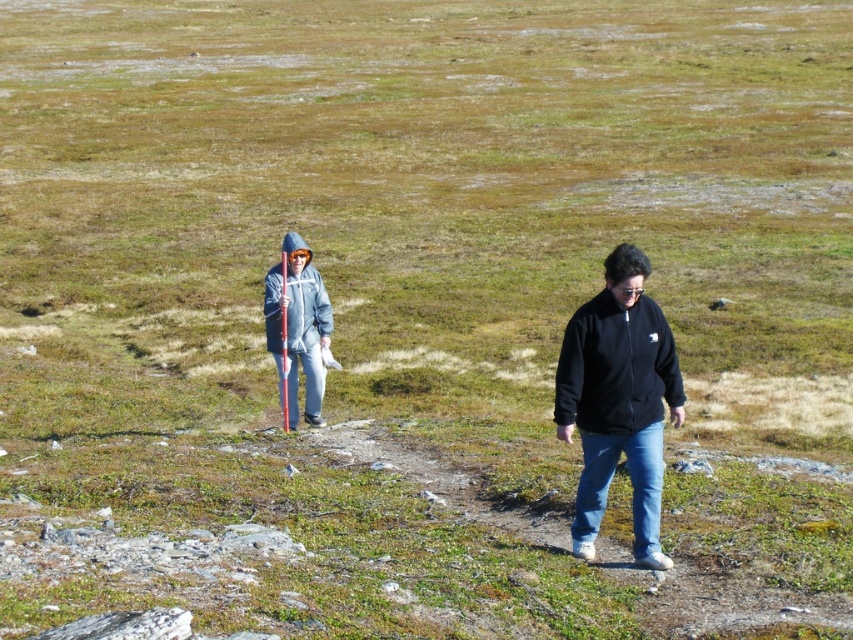
How distant is black matte jacket at center from matte gray jacket at center?

black matte jacket at center is 5.62 meters away from matte gray jacket at center.

Can you confirm if black matte jacket at center is positioned to the left of matte gray jacket at center?

Incorrect, black matte jacket at center is not on the left side of matte gray jacket at center.

Between point (578, 481) and point (291, 324), which one is positioned in front?

Positioned in front is point (578, 481).

Identify the location of black matte jacket at center. (618, 401).

Who is positioned more to the right, black matte jacket at center or black fleece sweatshirt at center?

black fleece sweatshirt at center

Which is in front, point (648, 376) or point (578, 372)?

Positioned in front is point (578, 372).

The width and height of the screenshot is (853, 640). What are the coordinates of `black matte jacket at center` in the screenshot? It's located at (618, 401).

Where is `black matte jacket at center`? The width and height of the screenshot is (853, 640). black matte jacket at center is located at coordinates (618, 401).

Between black fleece sweatshirt at center and matte gray jacket at center, which one appears on the right side from the viewer's perspective?

black fleece sweatshirt at center is more to the right.

Can you confirm if black fleece sweatshirt at center is shorter than matte gray jacket at center?

No, black fleece sweatshirt at center is not shorter than matte gray jacket at center.

Is point (610, 406) positioned after point (317, 342)?

No, (610, 406) is closer to viewer.

Locate an element on the screen. black fleece sweatshirt at center is located at coordinates (614, 365).